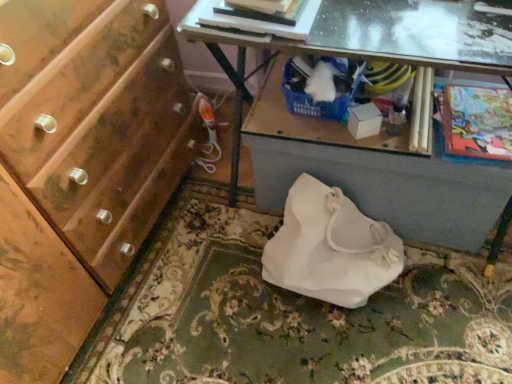
The height and width of the screenshot is (384, 512). In order to click on free spot to the right of white fabric bag at center in this screenshot , I will do `click(454, 304)`.